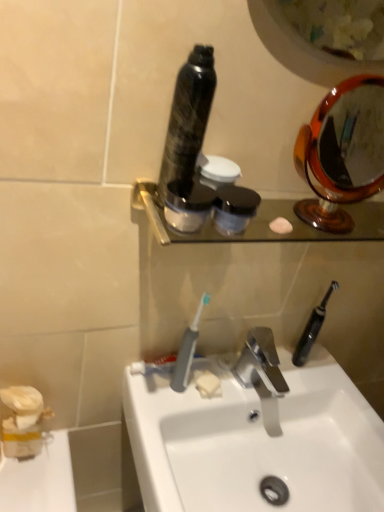
This screenshot has width=384, height=512. I want to click on vacant space to the right of polished chrome faucet at center, so click(330, 388).